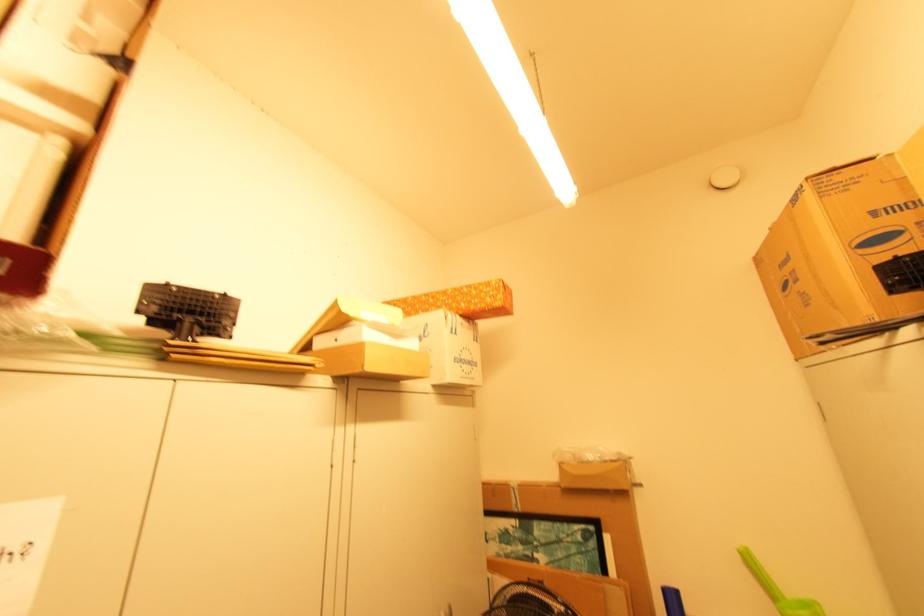
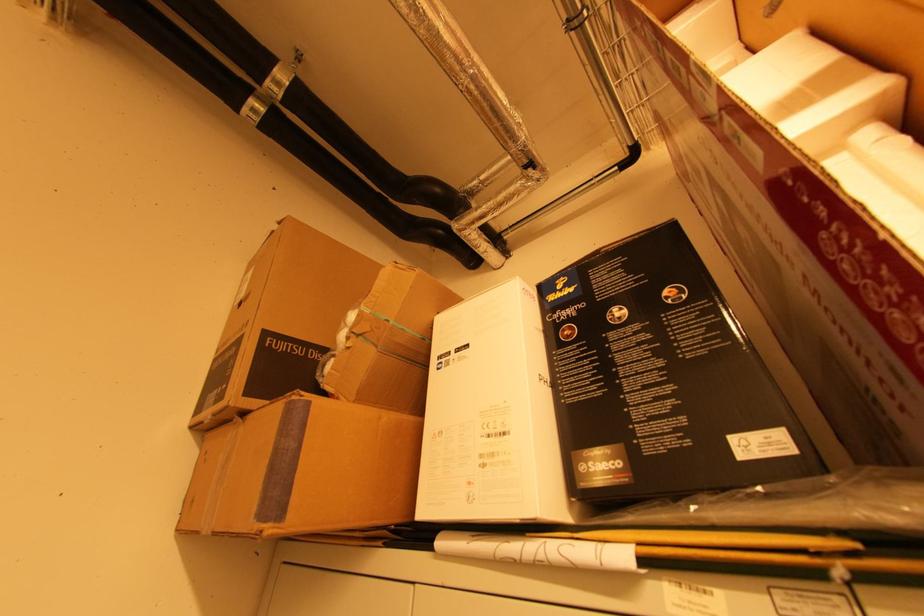
First-person continuous shooting, in which direction is the camera rotating?

The camera's rotation is toward left-up.